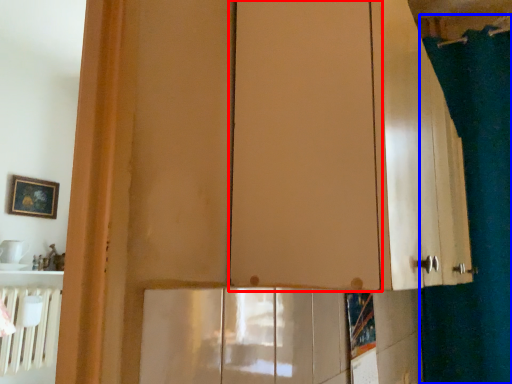
Question: Among these objects, which one is nearest to the camera, screen door (highlighted by a red box) or shower curtain (highlighted by a blue box)?

Choices:
 (A) screen door
 (B) shower curtain

Answer: (A)